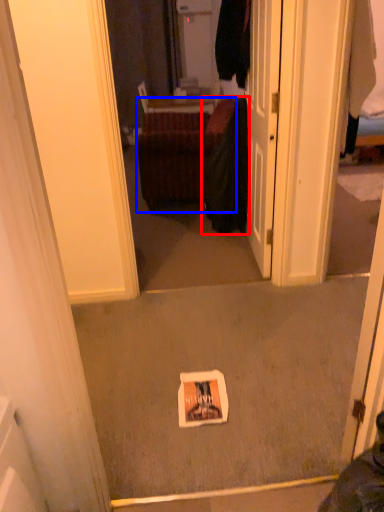
Question: Which point is closer to the camera, clothing (highlighted by a red box) or furniture (highlighted by a blue box)?

Choices:
 (A) clothing
 (B) furniture

Answer: (A)